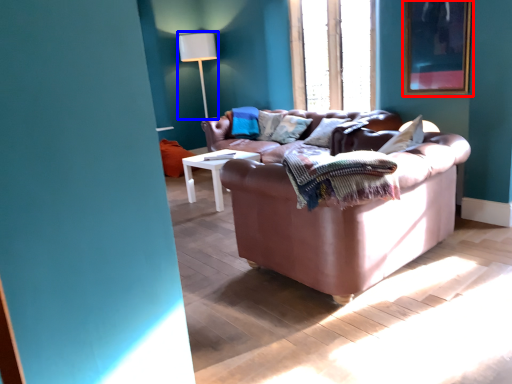
Question: Which object appears closest to the camera in this image, picture frame (highlighted by a red box) or table lamp (highlighted by a blue box)?

Choices:
 (A) picture frame
 (B) table lamp

Answer: (A)